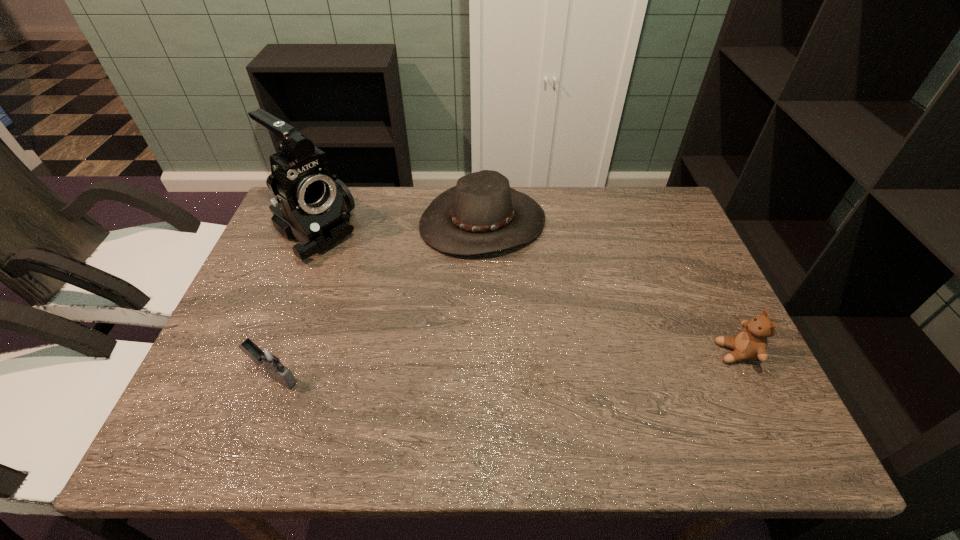
You are a GUI agent. You are given a task and a screenshot of the screen. Output one action in this format:
    pyautogui.click(x=<x>, y=<y>)
    Task: Click on the free space located 0.280m on the lens mount of the tallest object
    
    Given the screenshot: What is the action you would take?
    pyautogui.click(x=408, y=307)

This screenshot has height=540, width=960. What are the coordinates of `free location located on the front-facing side of the hat` in the screenshot? It's located at (571, 346).

Locate an element on the screen. The image size is (960, 540). free space located on the front-facing side of the hat is located at coordinates (588, 370).

Locate an element on the screen. This screenshot has width=960, height=540. vacant space located on the front-facing side of the hat is located at coordinates (521, 274).

Where is `camcorder that is positioned at the far edge`? camcorder that is positioned at the far edge is located at coordinates (312, 206).

You are a GUI agent. You are given a task and a screenshot of the screen. Output one action in this format:
    pyautogui.click(x=<x>, y=<y>)
    Task: Click on the hat that is positioned at the far edge
    The height and width of the screenshot is (540, 960).
    Given the screenshot: What is the action you would take?
    [x=482, y=214]

You are a GUI agent. You are given a task and a screenshot of the screen. Output one action in this format:
    pyautogui.click(x=<x>, y=<y>)
    Task: Click on the igniter that is positioned at the near edge
    
    Given the screenshot: What is the action you would take?
    pyautogui.click(x=267, y=357)

Where is `teddy bear situated at the near edge`? Image resolution: width=960 pixels, height=540 pixels. teddy bear situated at the near edge is located at coordinates (751, 343).

Locate an element on the screen. This screenshot has height=540, width=960. igniter at the left edge is located at coordinates (267, 357).

The image size is (960, 540). I want to click on camcorder located in the left edge section of the desktop, so click(312, 206).